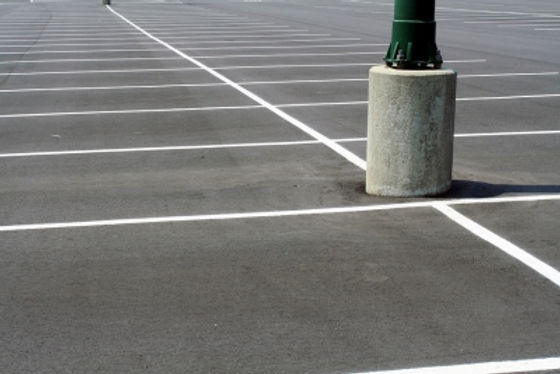
Find the location of a particular element. The height and width of the screenshot is (374, 560). light base is located at coordinates (442, 80), (392, 92), (417, 90), (417, 156), (445, 162), (435, 110), (396, 111), (387, 166), (106, 1).